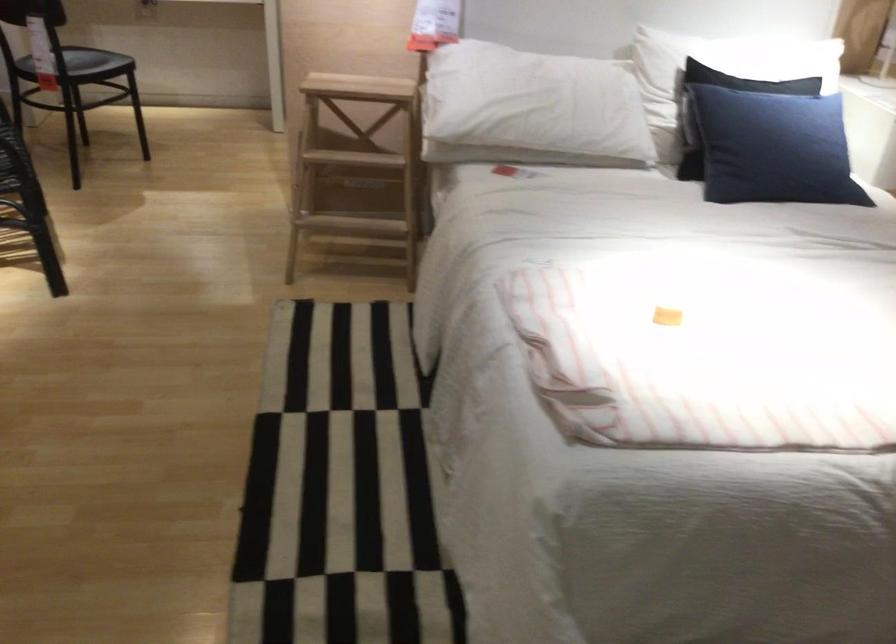
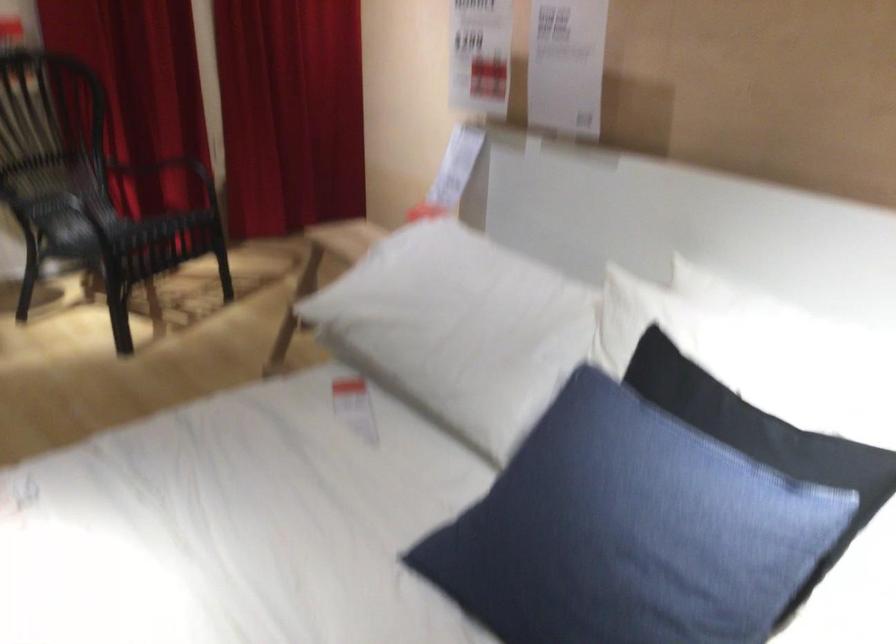
The point at (547,96) is marked in the first image. Where is the corresponding point in the second image?

(455, 321)